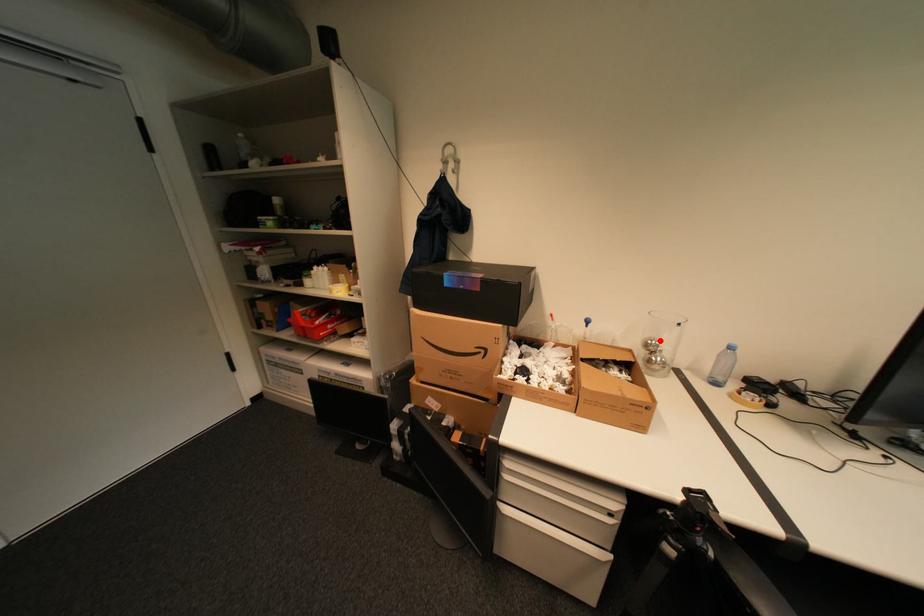
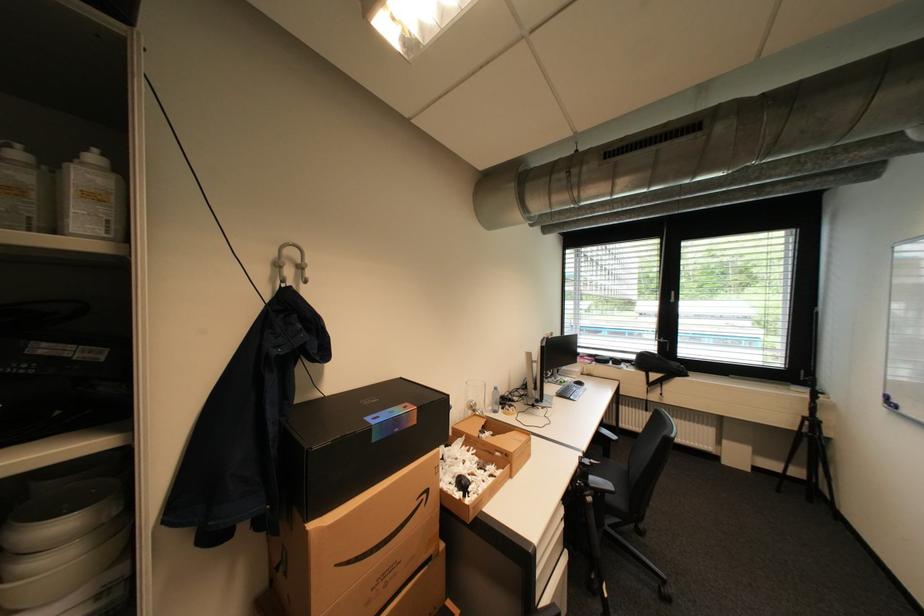
Question: A red point is marked in image1. In image2, is the corresponding 3D point closer to the camera or farther? Reply with the corresponding letter.

Choices:
 (A) The corresponding 3D point is closer.
 (B) The corresponding 3D point is farther.

Answer: (B)